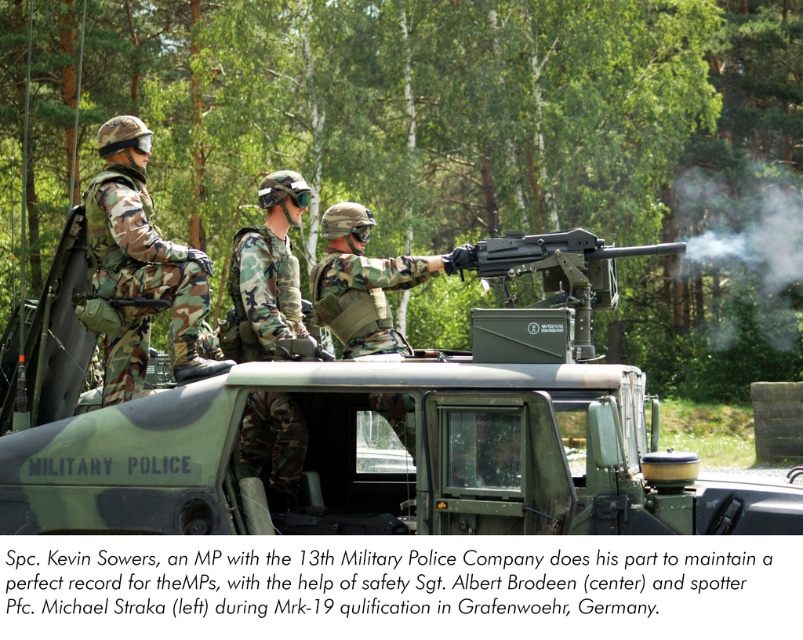
Question: Estimate the real-world distances between objects in this image. Which object is farther from the camo fabric uniform at left?

Choices:
 (A) matte black machine gun at center
 (B) camo fabric helmet at center

Answer: (A)

Question: Among these objects, which one is farthest from the camera?

Choices:
 (A) green matte military vehicle at center
 (B) camo fabric helmet at center

Answer: (B)

Question: Which of the following is the closest to the observer?

Choices:
 (A) (261, 340)
 (B) (3, 524)
 (C) (210, 346)

Answer: (B)

Question: From the image, what is the correct spatial relationship of camo fabric helmet at center in relation to matte black machine gun at center?

Choices:
 (A) above
 (B) below

Answer: (B)

Question: Does green matte military vehicle at center have a smaller size compared to matte black machine gun at center?

Choices:
 (A) yes
 (B) no

Answer: (B)

Question: Can you confirm if green matte military vehicle at center is positioned below camo fabric uniform at left?

Choices:
 (A) yes
 (B) no

Answer: (A)